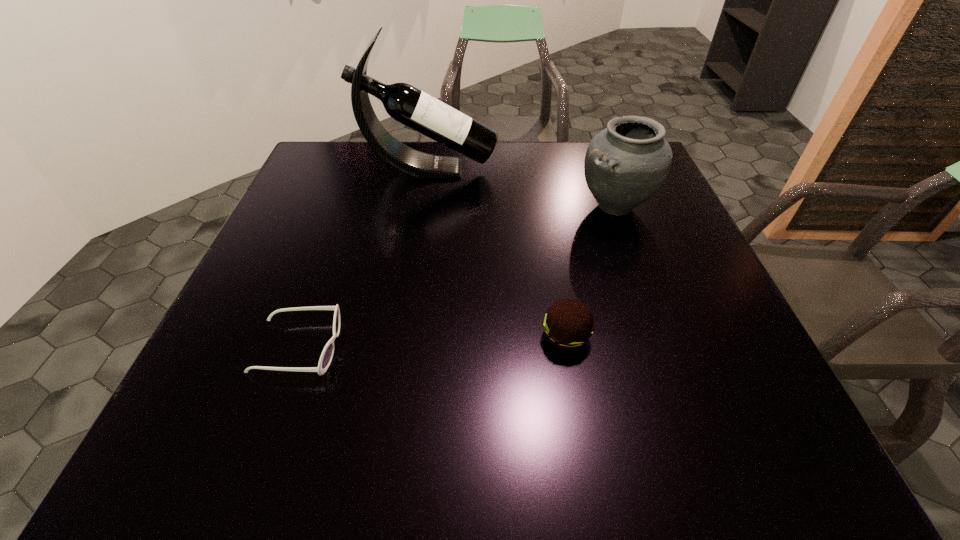
In the image, there is a desktop. Identify the location of vacant space at the left edge. (234, 381).

Find the location of `free space at the right edge`. free space at the right edge is located at coordinates (705, 293).

Identify the location of vacant space at the far left corner of the desktop. The width and height of the screenshot is (960, 540). (352, 168).

Locate an element on the screen. free space between the second tallest object and the second shortest object is located at coordinates (590, 272).

Locate an element on the screen. free spot between the rightmost object and the shortest object is located at coordinates [457, 276].

This screenshot has height=540, width=960. Find the location of `free point between the sunglasses and the rightmost object`. free point between the sunglasses and the rightmost object is located at coordinates (457, 276).

Identify the location of free space that is in between the third shortest object and the shortest object. This screenshot has width=960, height=540. (457, 276).

Locate an element on the screen. The height and width of the screenshot is (540, 960). free space between the patty and the rightmost object is located at coordinates (590, 272).

This screenshot has height=540, width=960. I want to click on free spot between the wine bottle and the shortest object, so click(x=364, y=258).

In order to click on vacant point located between the third tallest object and the shortest object in this screenshot , I will do tap(432, 342).